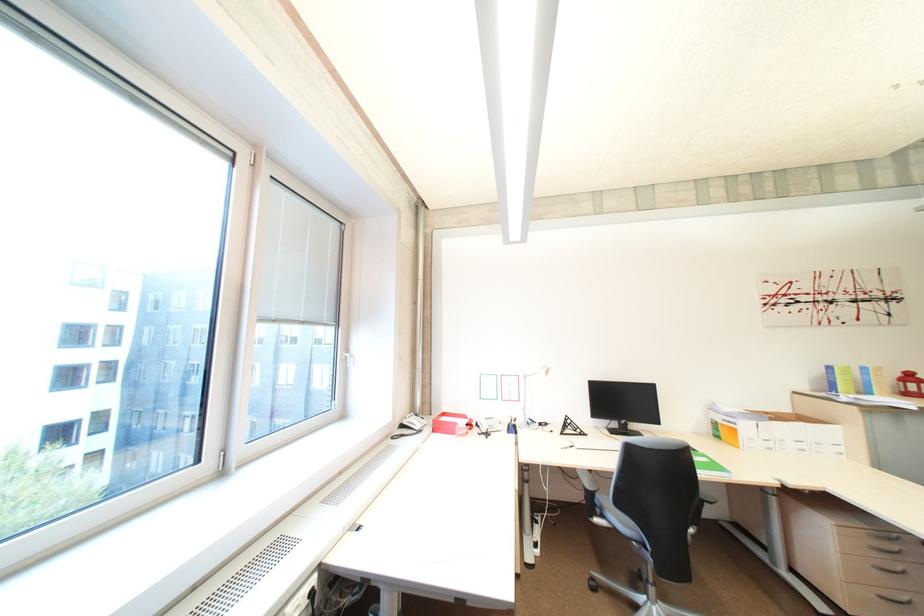
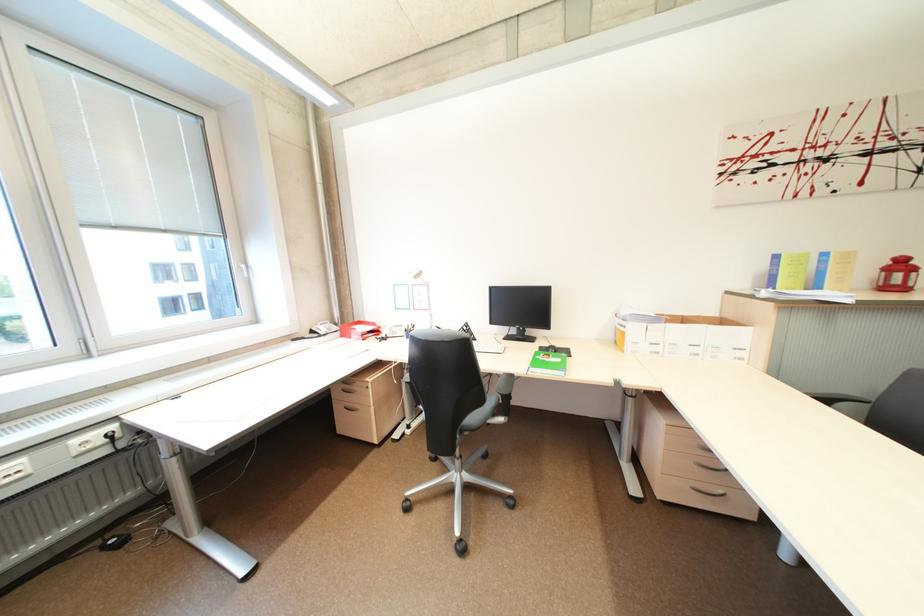
In the second image, find the point that corresponds to point (410, 427) in the first image.

(321, 333)